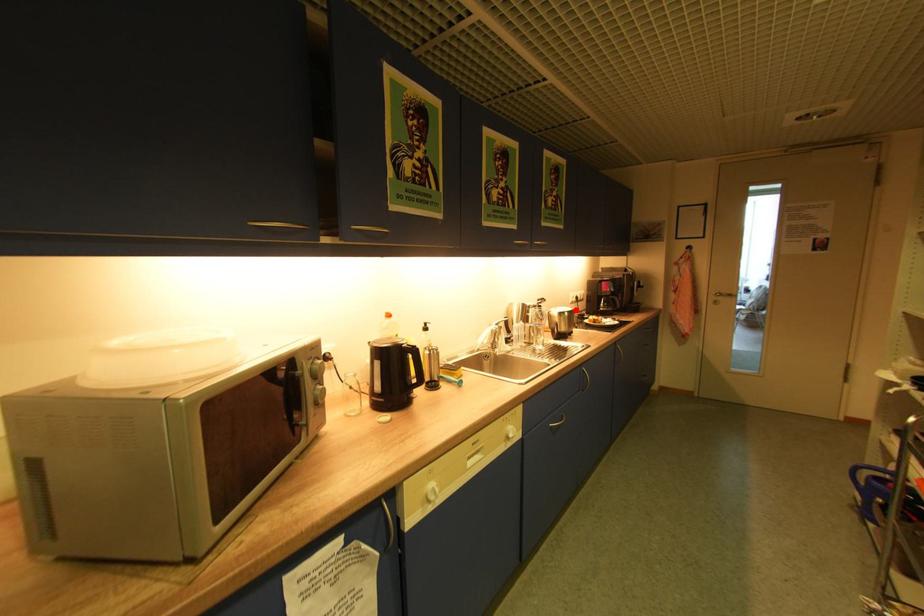
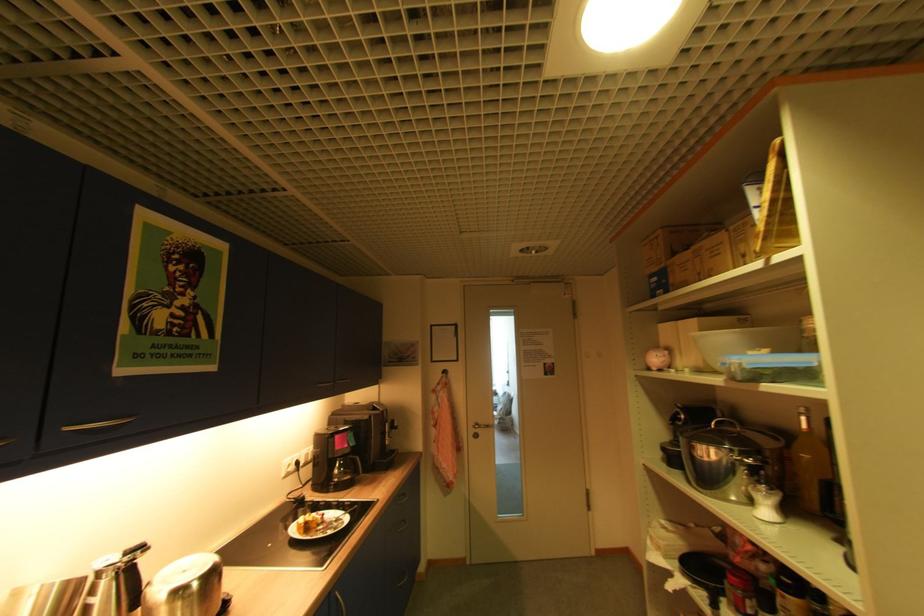
The point at the highlighted location is marked in the first image. Where is the corresponding point in the second image?

(217, 562)